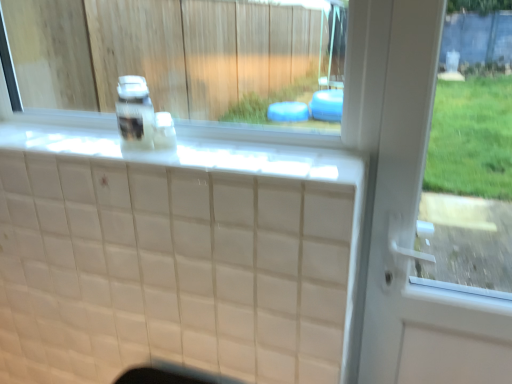
Question: Is white glossy window sill at upper center positioned in front of clear plastic bottle at center, marked as the second bottle in a right-to-left arrangement?

Choices:
 (A) yes
 (B) no

Answer: (A)

Question: Considering the relative positions of white glossy window sill at upper center and clear plastic bottle at center, which is counted as the 1th bottle, starting from the left, in the image provided, is white glossy window sill at upper center to the left of clear plastic bottle at center, which is counted as the 1th bottle, starting from the left, from the viewer's perspective?

Choices:
 (A) no
 (B) yes

Answer: (A)

Question: From the image's perspective, is white glossy window sill at upper center located above clear plastic bottle at center, which is counted as the 1th bottle, starting from the left?

Choices:
 (A) no
 (B) yes

Answer: (B)

Question: Is white glossy window sill at upper center facing towards clear plastic bottle at center, which is counted as the 1th bottle, starting from the left?

Choices:
 (A) no
 (B) yes

Answer: (B)

Question: Considering the relative sizes of white glossy window sill at upper center and clear plastic bottle at center, marked as the second bottle in a right-to-left arrangement, in the image provided, is white glossy window sill at upper center thinner than clear plastic bottle at center, marked as the second bottle in a right-to-left arrangement,?

Choices:
 (A) no
 (B) yes

Answer: (A)

Question: Does point (138, 119) appear closer or farther from the camera than point (165, 132)?

Choices:
 (A) closer
 (B) farther

Answer: (A)

Question: In terms of width, does clear plastic bottle at center, which is counted as the 1th bottle, starting from the left, look wider or thinner when compared to translucent plastic bottle at center, marked as the second bottle in a left-to-right arrangement?

Choices:
 (A) wide
 (B) thin

Answer: (A)

Question: From the image's perspective, is clear plastic bottle at center, marked as the second bottle in a right-to-left arrangement, positioned above or below translucent plastic bottle at center, acting as the first bottle starting from the right?

Choices:
 (A) below
 (B) above

Answer: (B)

Question: Based on their sizes in the image, would you say clear plastic bottle at center, which is counted as the 1th bottle, starting from the left, is bigger or smaller than translucent plastic bottle at center, acting as the first bottle starting from the right?

Choices:
 (A) small
 (B) big

Answer: (B)

Question: From a real-world perspective, is white glossy ledge at upper center physically located above or below white glossy window sill at upper center?

Choices:
 (A) above
 (B) below

Answer: (B)

Question: Is white glossy ledge at upper center wider or thinner than white glossy window sill at upper center?

Choices:
 (A) thin
 (B) wide

Answer: (B)

Question: Choose the correct answer: Is white glossy ledge at upper center inside white glossy window sill at upper center or outside it?

Choices:
 (A) outside
 (B) inside

Answer: (A)

Question: From the image's perspective, is white glossy ledge at upper center located above or below white glossy window sill at upper center?

Choices:
 (A) above
 (B) below

Answer: (B)

Question: Is point (349, 160) closer or farther from the camera than point (135, 122)?

Choices:
 (A) closer
 (B) farther

Answer: (A)

Question: Is white glossy ledge at upper center situated inside clear plastic bottle at center, marked as the second bottle in a right-to-left arrangement, or outside?

Choices:
 (A) inside
 (B) outside

Answer: (B)